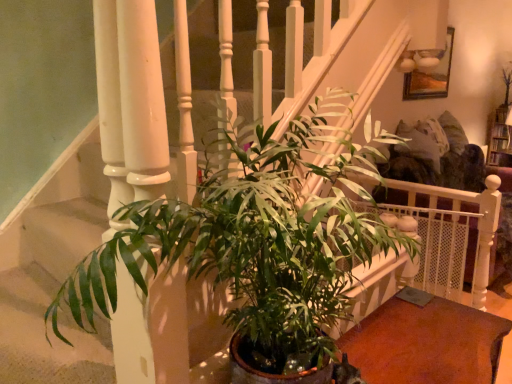
Question: Is smooth brown table at lower right positioned behind green glossy plant at center?

Choices:
 (A) no
 (B) yes

Answer: (B)

Question: Can you confirm if smooth brown table at lower right is bigger than green glossy plant at center?

Choices:
 (A) no
 (B) yes

Answer: (A)

Question: Is smooth brown table at lower right oriented towards green glossy plant at center?

Choices:
 (A) yes
 (B) no

Answer: (B)

Question: Can you confirm if smooth brown table at lower right is positioned to the left of green glossy plant at center?

Choices:
 (A) no
 (B) yes

Answer: (A)

Question: Is smooth brown table at lower right positioned far away from green glossy plant at center?

Choices:
 (A) no
 (B) yes

Answer: (A)

Question: From the image's perspective, is smooth brown table at lower right above green glossy plant at center?

Choices:
 (A) yes
 (B) no

Answer: (B)

Question: Would you say green glossy plant at center is outside smooth brown table at lower right?

Choices:
 (A) yes
 (B) no

Answer: (A)

Question: Does green glossy plant at center have a greater height compared to smooth brown table at lower right?

Choices:
 (A) no
 (B) yes

Answer: (B)

Question: Does green glossy plant at center have a lesser width compared to smooth brown table at lower right?

Choices:
 (A) no
 (B) yes

Answer: (A)

Question: Is green glossy plant at center with smooth brown table at lower right?

Choices:
 (A) no
 (B) yes

Answer: (A)

Question: From the image's perspective, is green glossy plant at center located above smooth brown table at lower right?

Choices:
 (A) no
 (B) yes

Answer: (B)

Question: Is smooth brown table at lower right a part of green glossy plant at center?

Choices:
 (A) yes
 (B) no

Answer: (B)

Question: Does point (426, 344) appear closer or farther from the camera than point (242, 271)?

Choices:
 (A) farther
 (B) closer

Answer: (A)